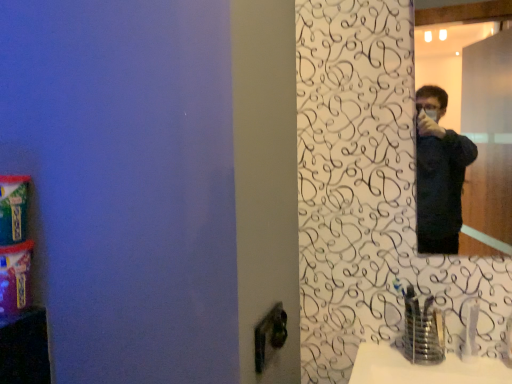
Question: From a real-world perspective, is white plastic faucet at lower right, which is the 1th faucet from right to left, beneath black matte mirror at upper right?

Choices:
 (A) yes
 (B) no

Answer: (A)

Question: Does white plastic faucet at lower right, which is the 1th faucet from right to left, lie behind black matte mirror at upper right?

Choices:
 (A) yes
 (B) no

Answer: (A)

Question: Considering the relative sizes of white plastic faucet at lower right, which is counted as the second faucet, starting from the left, and black matte mirror at upper right in the image provided, is white plastic faucet at lower right, which is counted as the second faucet, starting from the left, wider than black matte mirror at upper right?

Choices:
 (A) no
 (B) yes

Answer: (B)

Question: Does white plastic faucet at lower right, which is counted as the second faucet, starting from the left, have a lesser width compared to black matte mirror at upper right?

Choices:
 (A) yes
 (B) no

Answer: (B)

Question: From a real-world perspective, does white plastic faucet at lower right, which is counted as the second faucet, starting from the left, stand above black matte mirror at upper right?

Choices:
 (A) no
 (B) yes

Answer: (A)

Question: Considering the relative sizes of white plastic faucet at lower right, which is the 1th faucet from right to left, and black matte mirror at upper right in the image provided, is white plastic faucet at lower right, which is the 1th faucet from right to left, shorter than black matte mirror at upper right?

Choices:
 (A) yes
 (B) no

Answer: (A)

Question: Could you tell me if black matte mirror at upper right is facing white plastic faucet at lower right, which is counted as the second faucet, starting from the left?

Choices:
 (A) yes
 (B) no

Answer: (B)

Question: Are black matte mirror at upper right and white plastic faucet at lower right, which is counted as the second faucet, starting from the left, making contact?

Choices:
 (A) yes
 (B) no

Answer: (B)

Question: Considering the relative sizes of black matte mirror at upper right and white plastic faucet at lower right, which is the 1th faucet from right to left, in the image provided, is black matte mirror at upper right shorter than white plastic faucet at lower right, which is the 1th faucet from right to left,?

Choices:
 (A) no
 (B) yes

Answer: (A)

Question: Does black matte mirror at upper right lie in front of white plastic faucet at lower right, which is the 1th faucet from right to left?

Choices:
 (A) yes
 (B) no

Answer: (A)

Question: Does black matte mirror at upper right have a larger size compared to white plastic faucet at lower right, which is counted as the second faucet, starting from the left?

Choices:
 (A) no
 (B) yes

Answer: (B)

Question: Does black matte mirror at upper right have a lesser width compared to white plastic faucet at lower right, which is counted as the second faucet, starting from the left?

Choices:
 (A) no
 (B) yes

Answer: (B)

Question: Is the surface of white plastic faucet at lower right, which is counted as the second faucet, starting from the left, in direct contact with satin nickel faucet at lower right, the second faucet positioned from the right?

Choices:
 (A) no
 (B) yes

Answer: (B)